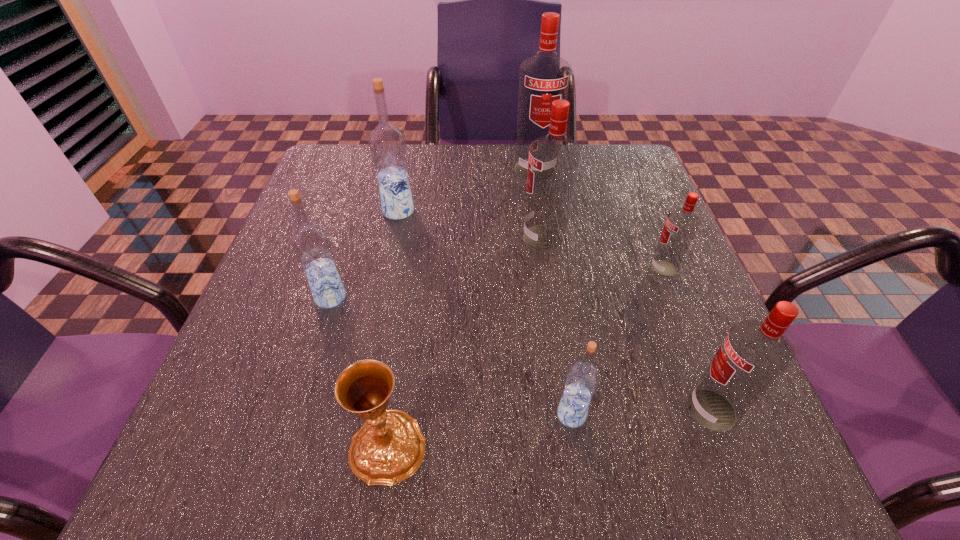
At what (x,y) coordinates should I click in order to perform the action: click on vacant space located on the front label of the nearest red vodka. Please return your answer as a coordinate pair (x, y). The width and height of the screenshot is (960, 540). Looking at the image, I should click on (588, 410).

This screenshot has height=540, width=960. I want to click on free spot located on the front label of the nearest red vodka, so click(x=496, y=410).

The height and width of the screenshot is (540, 960). What are the coordinates of `free space located on the front label of the nearest red vodka` in the screenshot? It's located at (628, 410).

Identify the location of vacant space situated 0.140m on the front label of the third farthest red vodka. (580, 269).

The width and height of the screenshot is (960, 540). I want to click on vacant point located on the front label of the third farthest red vodka, so click(625, 269).

This screenshot has width=960, height=540. I want to click on free location located on the front label of the third farthest red vodka, so click(x=535, y=269).

This screenshot has height=540, width=960. Identify the location of free spot located on the left of the smallest blue vodka. (491, 415).

What are the coordinates of `free space located on the right of the gold chalice` in the screenshot? It's located at (523, 446).

Where is `object that is at the far edge`? object that is at the far edge is located at coordinates (544, 77).

Where is `vodka that is positioned at the near edge`? The image size is (960, 540). vodka that is positioned at the near edge is located at coordinates (754, 354).